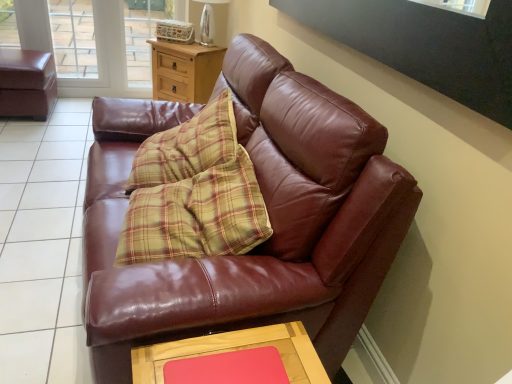
Question: Considering the relative sizes of shiny brown leather couch at center and rubberized pink mat at lower center in the image provided, is shiny brown leather couch at center bigger than rubberized pink mat at lower center?

Choices:
 (A) no
 (B) yes

Answer: (B)

Question: Considering the relative sizes of shiny brown leather couch at center and rubberized pink mat at lower center in the image provided, is shiny brown leather couch at center taller than rubberized pink mat at lower center?

Choices:
 (A) yes
 (B) no

Answer: (A)

Question: Can you confirm if shiny brown leather couch at center is smaller than rubberized pink mat at lower center?

Choices:
 (A) yes
 (B) no

Answer: (B)

Question: Is the depth of shiny brown leather couch at center less than that of rubberized pink mat at lower center?

Choices:
 (A) no
 (B) yes

Answer: (B)

Question: Can we say shiny brown leather couch at center lies outside rubberized pink mat at lower center?

Choices:
 (A) no
 (B) yes

Answer: (B)

Question: From the image's perspective, does shiny brown leather couch at center appear lower than rubberized pink mat at lower center?

Choices:
 (A) no
 (B) yes

Answer: (A)

Question: From a real-world perspective, does transparent glass screen door at upper left stand above wooden table at lower center?

Choices:
 (A) yes
 (B) no

Answer: (A)

Question: Is transparent glass screen door at upper left far from wooden table at lower center?

Choices:
 (A) yes
 (B) no

Answer: (A)

Question: Does transparent glass screen door at upper left lie behind wooden table at lower center?

Choices:
 (A) yes
 (B) no

Answer: (A)

Question: From the image's perspective, is transparent glass screen door at upper left below wooden table at lower center?

Choices:
 (A) yes
 (B) no

Answer: (B)

Question: Are transparent glass screen door at upper left and wooden table at lower center making contact?

Choices:
 (A) no
 (B) yes

Answer: (A)

Question: Is transparent glass screen door at upper left closer to camera compared to wooden table at lower center?

Choices:
 (A) no
 (B) yes

Answer: (A)

Question: Is clear glass lamp at upper center oriented towards transparent glass screen door at upper left?

Choices:
 (A) yes
 (B) no

Answer: (B)